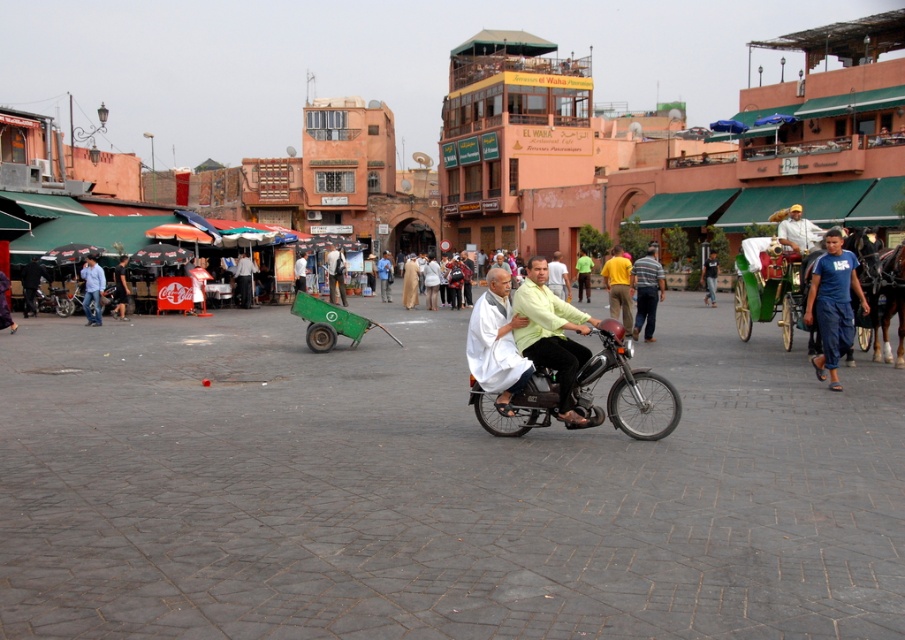
You are a street performer preparing to set up your equipment in the urban square. You have a white cloth at center and a green matte cart at center. Which object is wider?

The green matte cart at center is wider than the white cloth at center.

You are standing at the entrance of the urban square and see the green matte cart at center. If you walk straight ahead, will you reach the cart before the motorcycle?

The green matte cart at center is located at point (330, 323), so yes, walking straight ahead would reach the cart before the motorcycle.

You are a photographer planning to capture a candid shot of the white cloth at center and the white fabric person at center in the urban square. Based on their sizes, which one should you focus on first to ensure they both fit well in the frame?

The white cloth at center is smaller than the white fabric person at center, so you should focus on the white fabric person at center first to ensure both fit well in the frame.